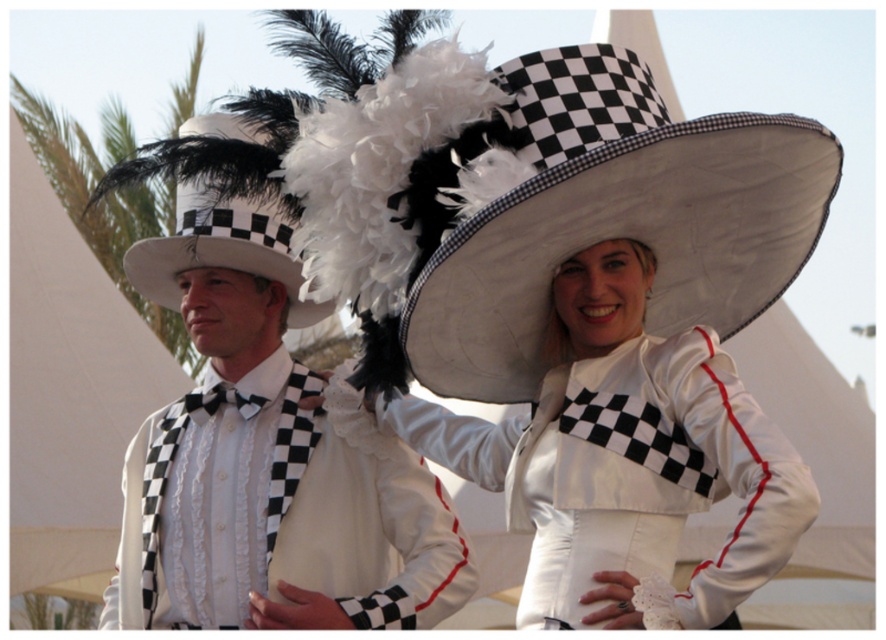
Who is positioned more to the right, matte black bow tie at left or white matte cowboy hat at center?

white matte cowboy hat at center is more to the right.

Is matte black bow tie at left to the right of white matte cowboy hat at center from the viewer's perspective?

In fact, matte black bow tie at left is to the left of white matte cowboy hat at center.

Does point (226, 298) come behind point (649, 141)?

That is True.

This screenshot has width=886, height=640. In order to click on matte black bow tie at left in this screenshot , I will do `click(267, 460)`.

Is satin white hat at upper center in front of matte black and white checkered cowboy hat at left?

Yes.

Between point (589, 385) and point (267, 227), which one is positioned in front?

Point (589, 385) is in front.

Is point (733, 458) behind point (278, 228)?

No.

I want to click on satin white hat at upper center, so click(x=626, y=458).

Is matte black bow tie at left to the left of matte black and white checkered cowboy hat at left from the viewer's perspective?

Incorrect, matte black bow tie at left is not on the left side of matte black and white checkered cowboy hat at left.

Where is `matte black bow tie at left`? Image resolution: width=886 pixels, height=640 pixels. matte black bow tie at left is located at coordinates (267, 460).